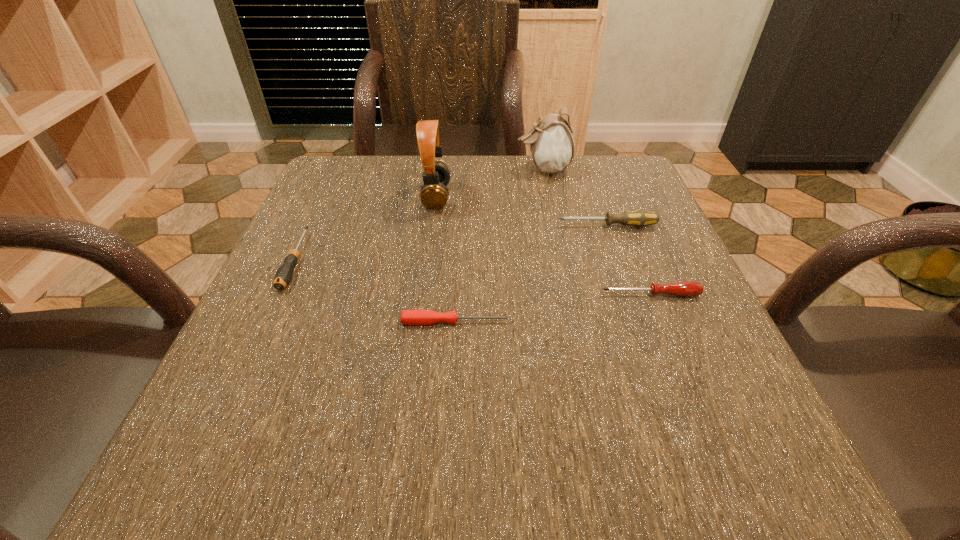
I want to click on free space in the image that satisfies the following two spatial constraints: 1. on the front-facing side of the farthest object; 2. on the front side of the leftmost screwdriver, so click(x=563, y=260).